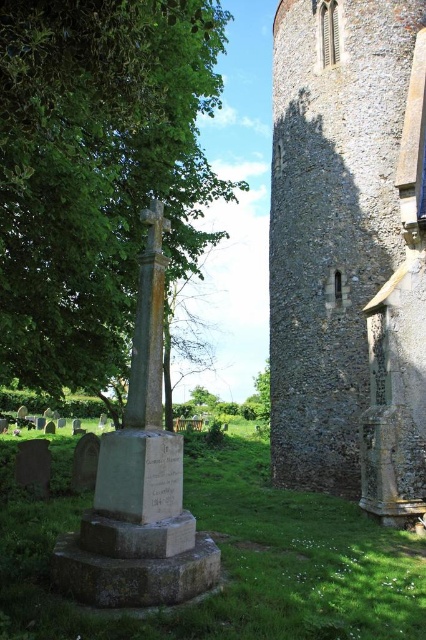
You are standing in the churchyard and want to take a photo of the gray stone tower at right and the green leafy tree at center. Which object should you position to the right side of your camera frame to include both in the shot?

The gray stone tower at right is to the right of the green leafy tree at center, so you should position the gray stone tower at right to the right side of your camera frame to include both in the shot.

You are standing in the churchyard and want to take a photo of both the gray stone tower at right and the green leafy tree at center. Which object should you position closer to the camera to ensure both are in focus?

You should position the gray stone tower at right closer to the camera since it is closer to the viewer than the green leafy tree at center, allowing both to be in focus when framed properly.

You are a gardener who needs to water the green leafy tree at center. You have a hose that can reach 15 meters. The gray stone tower at right is in the way. Can you reach the tree from your current position near the tower without moving the tower?

The gray stone tower at right and green leafy tree at center are 14.47 meters apart from each other. Since the hose can reach 15 meters, you can water the tree from the current position near the tower without moving it.